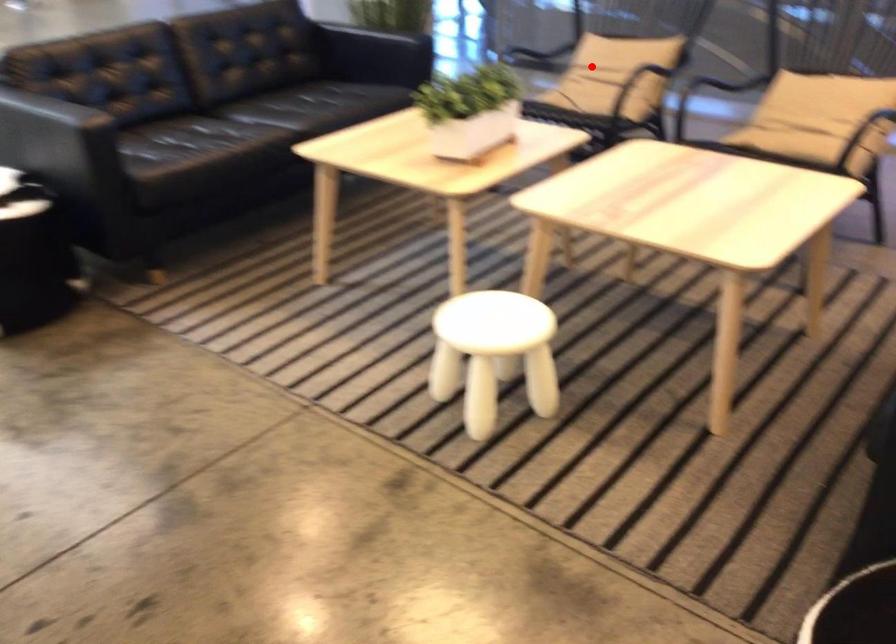
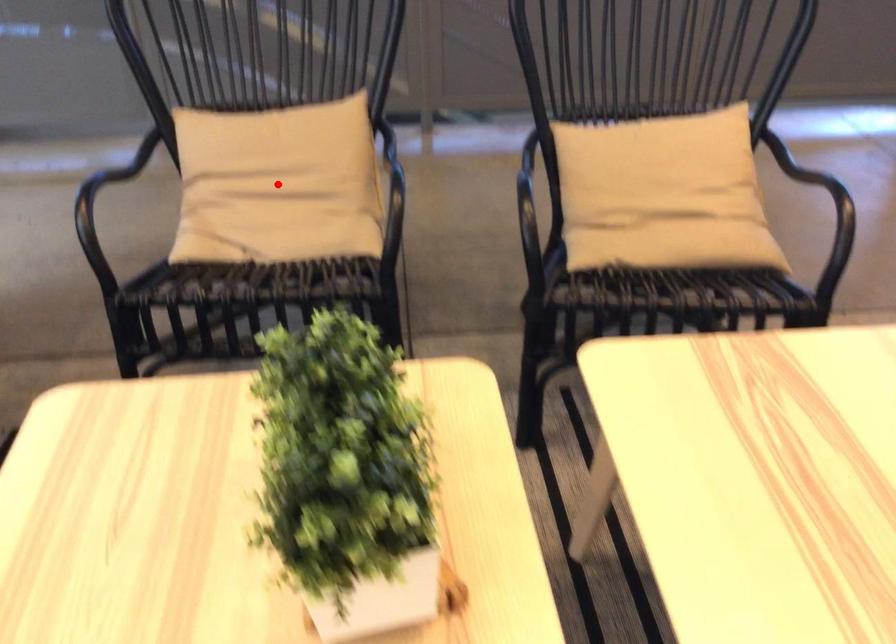
I am providing you with two images of the same scene from different viewpoints. A red point is marked on the first image and another point is marked on the second image. Does the point marked in image1 correspond to the same location as the one in image2?

Yes